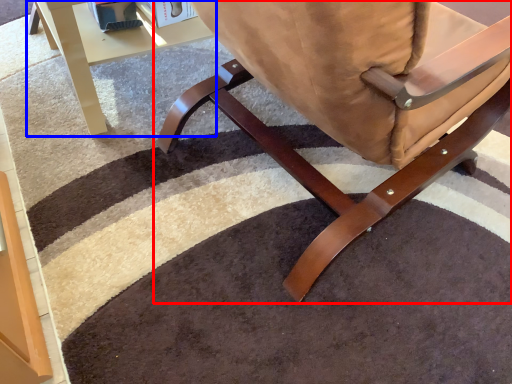
Question: Which of the following is the closest to the observer, chair (highlighted by a red box) or table (highlighted by a blue box)?

Choices:
 (A) chair
 (B) table

Answer: (A)